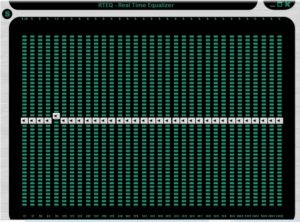
Identify the location of screen. The height and width of the screenshot is (222, 300). (15, 97).